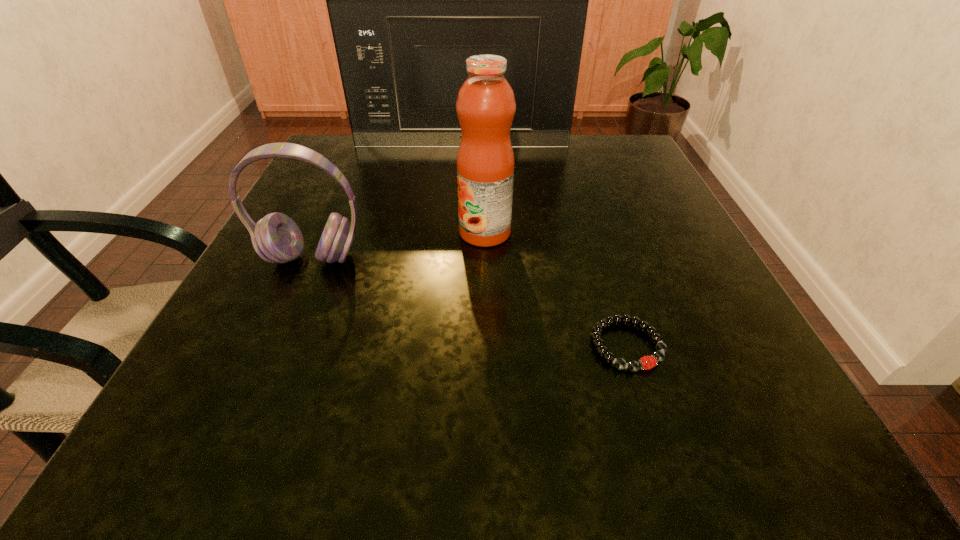
Locate an element on the screen. The image size is (960, 540). the farthest object is located at coordinates (409, 0).

Find the location of a particular element. Image resolution: width=960 pixels, height=540 pixels. fruit juice is located at coordinates (485, 106).

The image size is (960, 540). Find the location of `the second shortest object`. the second shortest object is located at coordinates (276, 238).

At what (x,y) coordinates should I click in order to perform the action: click on the shortest object. Please return your answer as a coordinate pair (x, y). Image resolution: width=960 pixels, height=540 pixels. Looking at the image, I should click on (647, 362).

Find the location of a particular element. the nearest object is located at coordinates (647, 362).

Where is `vacant space situated on the front panel of the farthest object`? vacant space situated on the front panel of the farthest object is located at coordinates (455, 245).

What are the coordinates of `vacant space located on the front label of the fruit juice` in the screenshot? It's located at (371, 232).

Identify the location of vacant space located 0.240m on the front label of the fruit juice. (325, 232).

Where is `vacant space located on the front label of the fruit juice`? vacant space located on the front label of the fruit juice is located at coordinates (343, 232).

This screenshot has width=960, height=540. I want to click on free space located 0.230m on the headband and ear cups of the headset, so click(x=251, y=400).